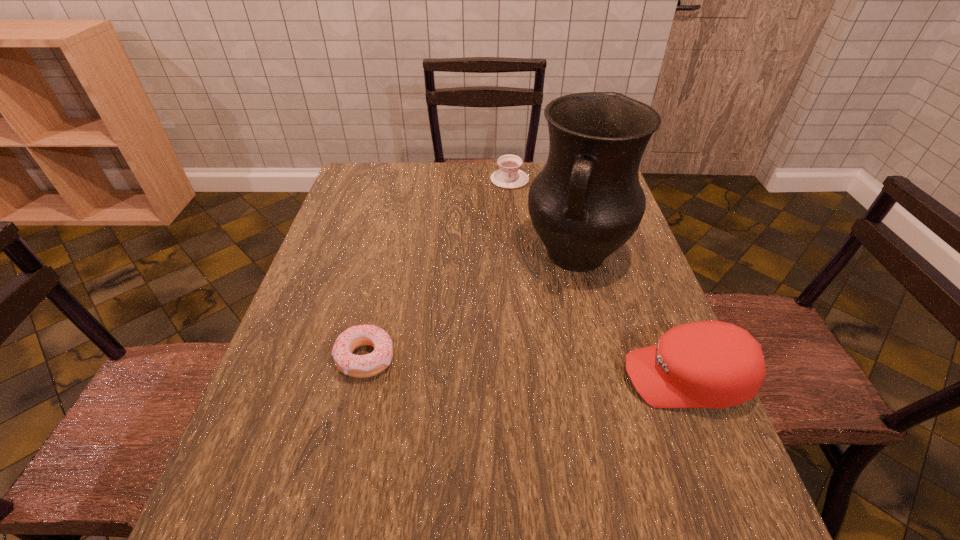
The image size is (960, 540). In order to click on free space on the desktop that is between the leftmost object and the second tallest object and is positioned on the handle side of the pitcher in this screenshot , I will do `click(530, 368)`.

Locate an element on the screen. This screenshot has height=540, width=960. vacant spot on the desktop that is between the doughnut and the third shortest object and is positioned on the handle side of the teacup is located at coordinates (513, 367).